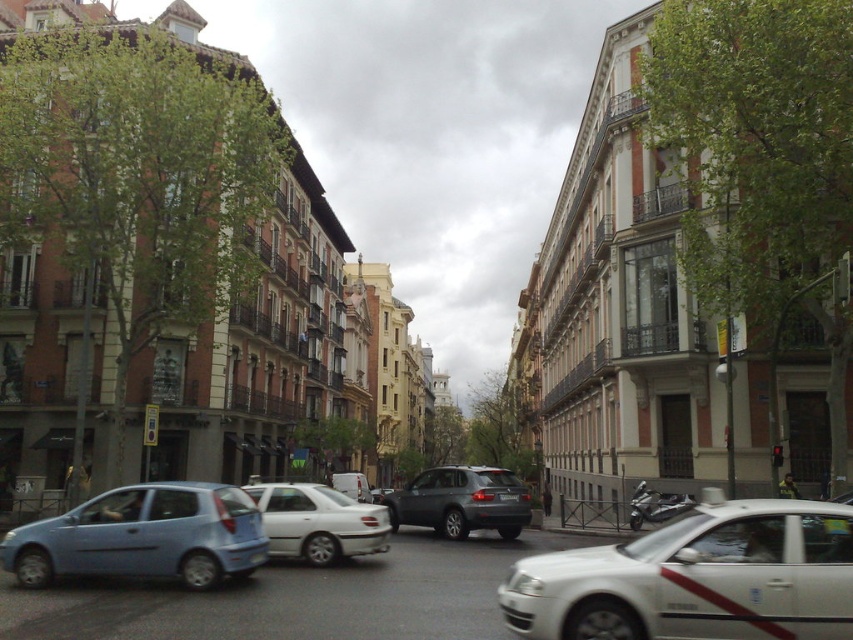
You are a pedestrian standing on the sidewalk and want to cross the street. There is a metallic gray suv at center and a white matte van at center. Which vehicle is closer to you?

The metallic gray suv at center is closer to you because it is in front of the white matte van at center.

Looking at this image, you are a delivery driver who needs to park your vehicle between the matte blue hatchback at left and the white matte van at center. Is there enough space between them to fit your 2.5 meter long delivery truck?

The matte blue hatchback at left is positioned on the left side of the white matte van at center. However, the exact distance between them is not provided, so it is impossible to determine if there is enough space for a 2.5 meter long delivery truck.